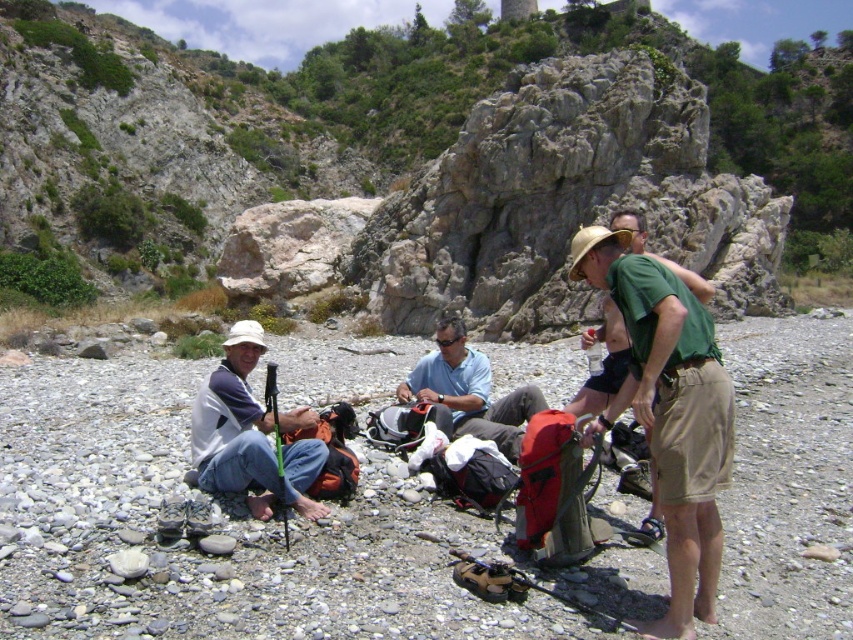
Between white matte hat at lower left and light blue fabric shirt at center, which one has less height?

With less height is light blue fabric shirt at center.

Does white matte hat at lower left have a greater height compared to light blue fabric shirt at center?

Correct, white matte hat at lower left is much taller as light blue fabric shirt at center.

Does point (231, 404) come closer to viewer compared to point (451, 369)?

That is True.

Locate an element on the screen. This screenshot has width=853, height=640. white matte hat at lower left is located at coordinates (235, 426).

Is khaki shorts at center smaller than white matte hat at lower left?

Correct, khaki shorts at center occupies less space than white matte hat at lower left.

Is point (645, 419) positioned before point (265, 465)?

Yes, point (645, 419) is closer to viewer.

Identify the location of khaki shorts at center. (669, 412).

Is point (614, 416) in front of point (416, 396)?

Yes, it is.

Which of these two, khaki shorts at center or light blue fabric shirt at center, stands shorter?

With less height is khaki shorts at center.

You are a GUI agent. You are given a task and a screenshot of the screen. Output one action in this format:
    pyautogui.click(x=<x>, y=<y>)
    Task: Click on the khaki shorts at center
    This screenshot has height=640, width=853.
    Given the screenshot: What is the action you would take?
    pyautogui.click(x=669, y=412)